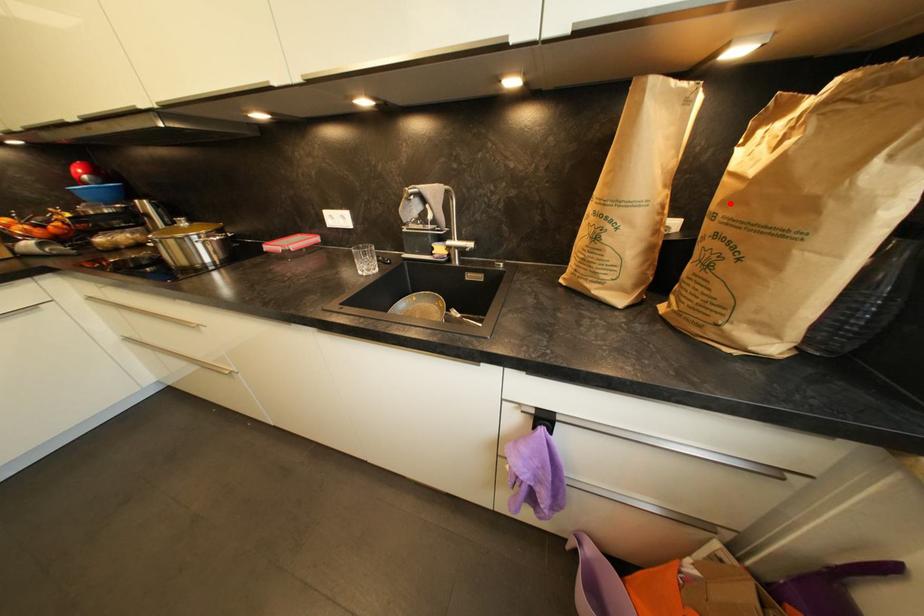
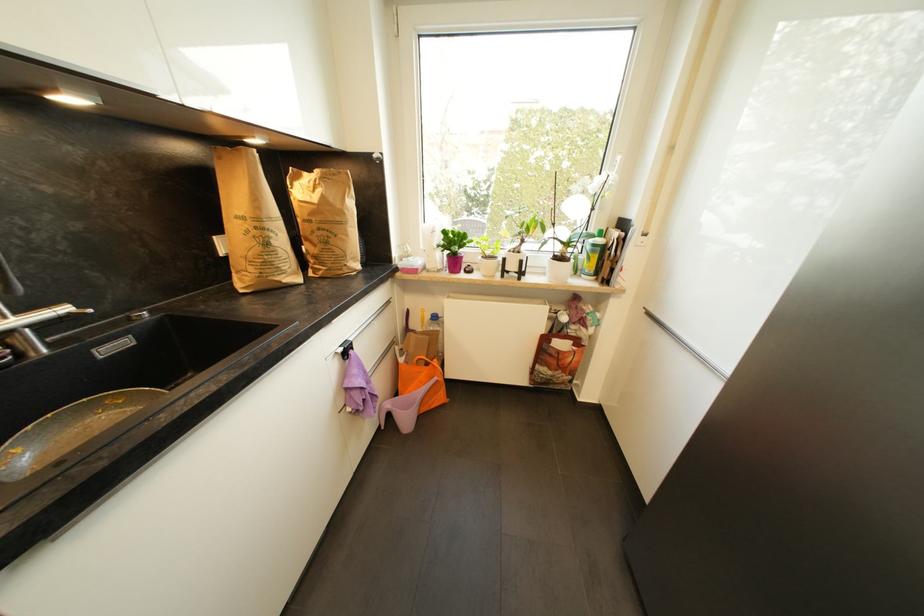
Find the pixel in the second image that matches the highlighted location in the first image.

(317, 216)